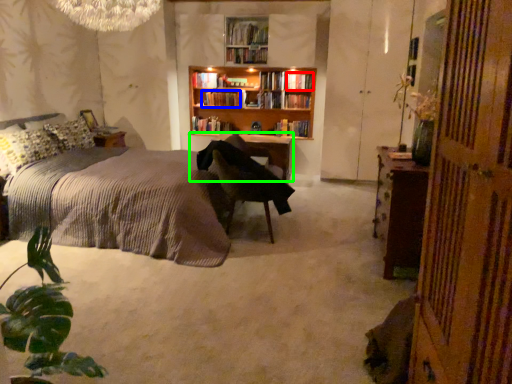
Question: Which is farther away from book (highlighted by a red box)? book (highlighted by a blue box) or table (highlighted by a green box)?

Choices:
 (A) book
 (B) table

Answer: (B)